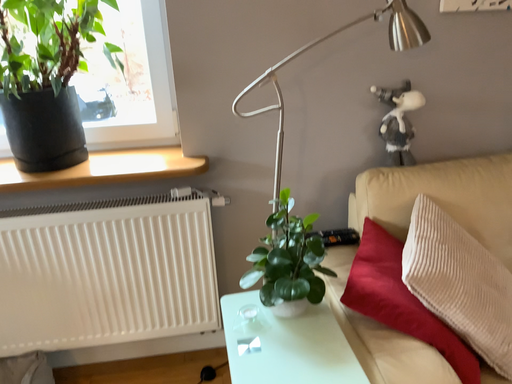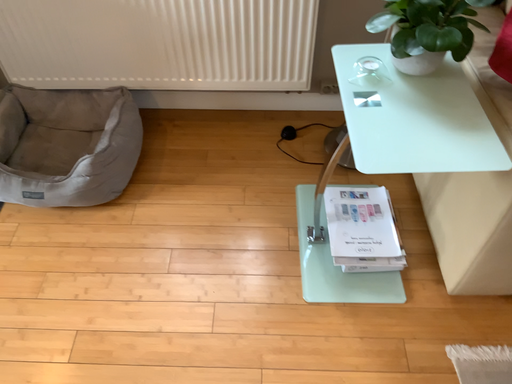
Question: Which way did the camera rotate in the video?

Choices:
 (A) rotated upward
 (B) rotated downward

Answer: (B)